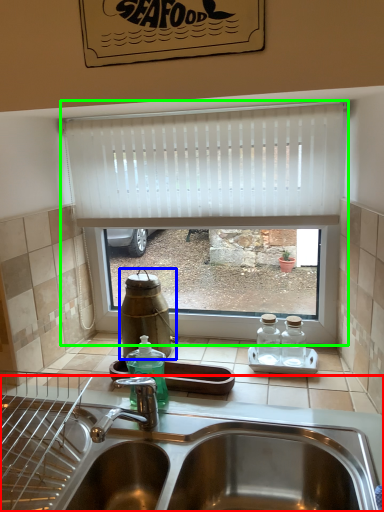
Question: Based on their relative distances, which object is nearer to sink (highlighted by a red box)? Choose from bottle (highlighted by a blue box) and window (highlighted by a green box).

Choices:
 (A) bottle
 (B) window

Answer: (A)